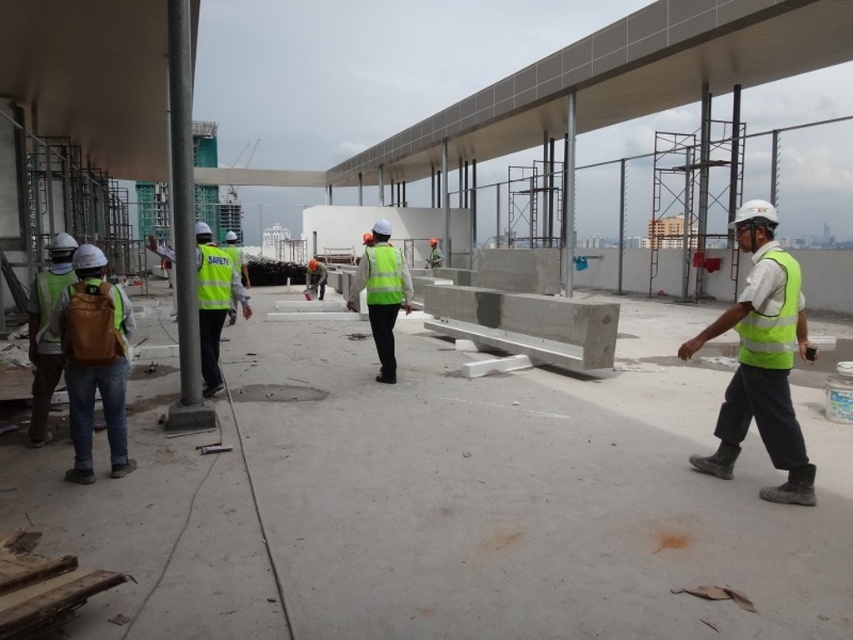
Question: Does yellow reflective safety vest at right appear over yellow reflective safety vest at center?

Choices:
 (A) no
 (B) yes

Answer: (A)

Question: Which point is farther to the camera?

Choices:
 (A) (793, 502)
 (B) (369, 276)
 (C) (62, 269)

Answer: (B)

Question: Does reflective yellow safety vest at left lie in front of green reflective vest at center?

Choices:
 (A) yes
 (B) no

Answer: (A)

Question: Which object appears closest to the camera in this image?

Choices:
 (A) brown fabric vest at left
 (B) yellow reflective safety vest at center
 (C) yellow reflective vest at left

Answer: (A)

Question: Is yellow reflective vest at left positioned behind yellow reflective safety vest at right?

Choices:
 (A) yes
 (B) no

Answer: (A)

Question: Which of the following is the closest to the observer?

Choices:
 (A) brown fabric backpack at left
 (B) yellow reflective vest at left

Answer: (A)